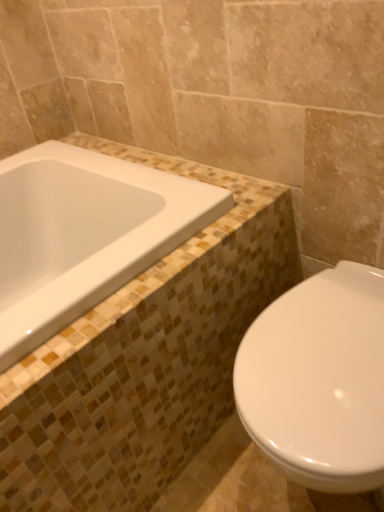
Question: From their relative heights in the image, would you say white glossy bathtub at upper left is taller or shorter than white glossy toilet at lower right?

Choices:
 (A) tall
 (B) short

Answer: (B)

Question: Considering their positions, is white glossy bathtub at upper left located in front of or behind white glossy toilet at lower right?

Choices:
 (A) front
 (B) behind

Answer: (B)

Question: Considering the relative positions of white glossy bathtub at upper left and white glossy toilet at lower right in the image provided, is white glossy bathtub at upper left to the left or to the right of white glossy toilet at lower right?

Choices:
 (A) right
 (B) left

Answer: (B)

Question: Relative to white glossy bathtub at upper left, is white glossy toilet at lower right in front or behind?

Choices:
 (A) behind
 (B) front

Answer: (B)

Question: From the image's perspective, is white glossy toilet at lower right above or below white glossy bathtub at upper left?

Choices:
 (A) below
 (B) above

Answer: (A)

Question: Visually, is white glossy toilet at lower right positioned to the left or to the right of white glossy bathtub at upper left?

Choices:
 (A) right
 (B) left

Answer: (A)

Question: From a real-world perspective, relative to white glossy bathtub at upper left, is white glossy toilet at lower right vertically above or below?

Choices:
 (A) below
 (B) above

Answer: (A)